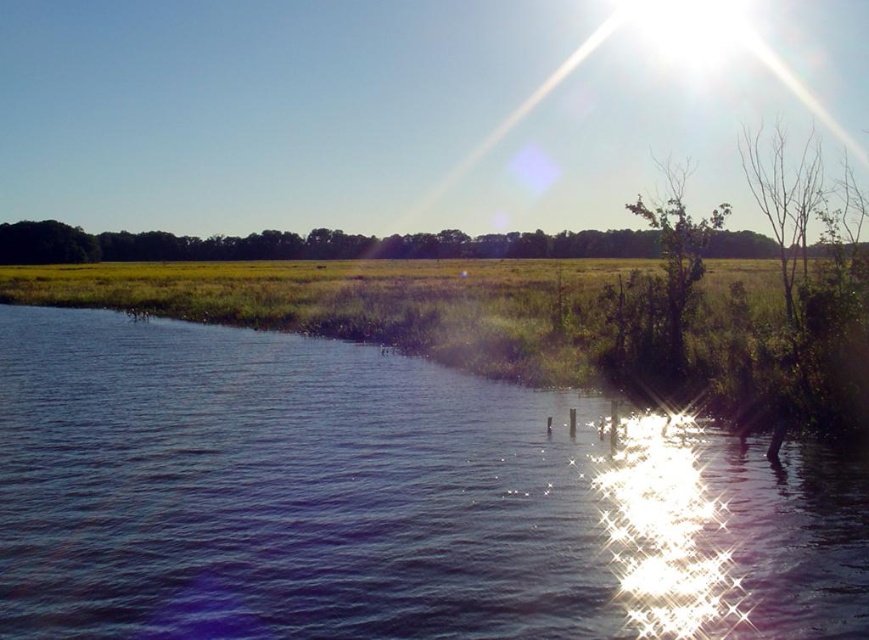
You are a bird looking for a place to perch. You see the green matte tree at upper center and the green leafy tree at upper right. Which tree has a larger canopy for you to land on?

The green matte tree at upper center might be wider than green leafy tree at upper right, so it likely has a larger canopy for you to land on.

You are standing at the edge of the blue water at center and want to throw a pebble to reach the grassy field in the middle ground. If you can throw a pebble 8 meters, will it land on the grassy field?

The blue water at center is 7.75 meters away from the viewer. Since the viewer can throw a pebble 8 meters, which is farther than the distance to the grassy field, the pebble will land on the grassy field.

You are standing at the edge of the water and looking towards the upper right corner of the image. Which tree is closer to you, the bare branches at upper right or the green leafy tree at upper right?

The bare branches at upper right is closer to the viewer than the green leafy tree at upper right.